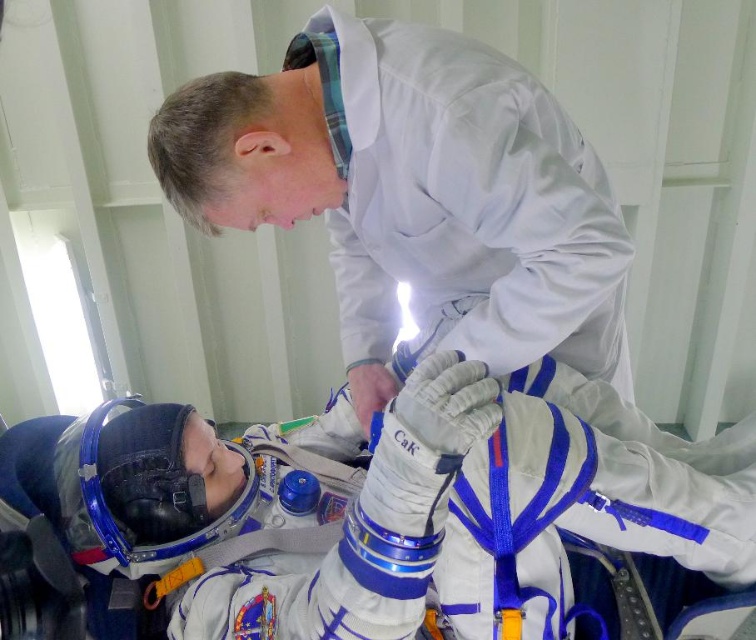
Question: Does white fabric spacesuit at lower left appear on the left side of white smooth lab coat at upper center?

Choices:
 (A) yes
 (B) no

Answer: (A)

Question: Which object appears closest to the camera in this image?

Choices:
 (A) white smooth lab coat at upper center
 (B) white fabric spacesuit at lower left

Answer: (B)

Question: Can you confirm if white fabric spacesuit at lower left is positioned to the right of white smooth lab coat at upper center?

Choices:
 (A) no
 (B) yes

Answer: (A)

Question: Is the position of white fabric spacesuit at lower left less distant than that of white smooth lab coat at upper center?

Choices:
 (A) yes
 (B) no

Answer: (A)

Question: Among these points, which one is nearest to the camera?

Choices:
 (A) (510, 531)
 (B) (375, 49)

Answer: (A)